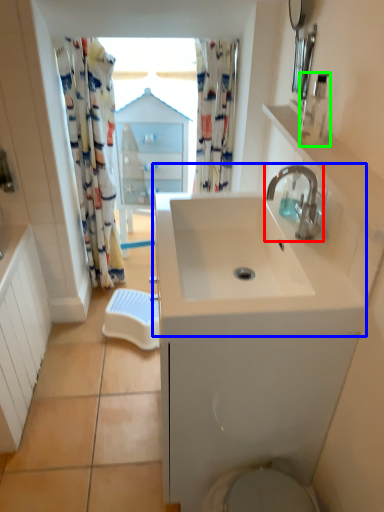
Question: Estimate the real-world distances between objects in this image. Which object is closer to tap (highlighted by a red box), sink (highlighted by a blue box) or soap dispenser (highlighted by a green box)?

Choices:
 (A) sink
 (B) soap dispenser

Answer: (B)